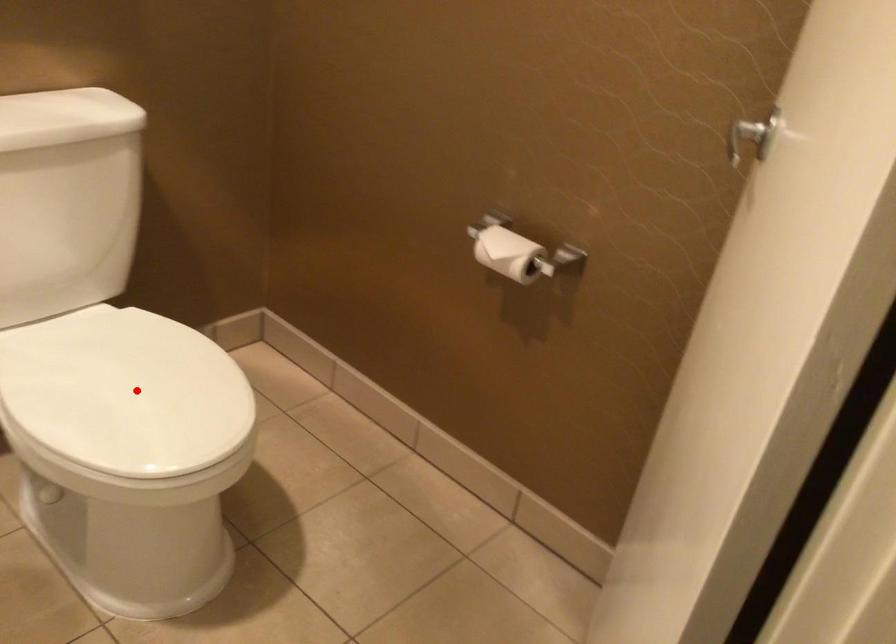
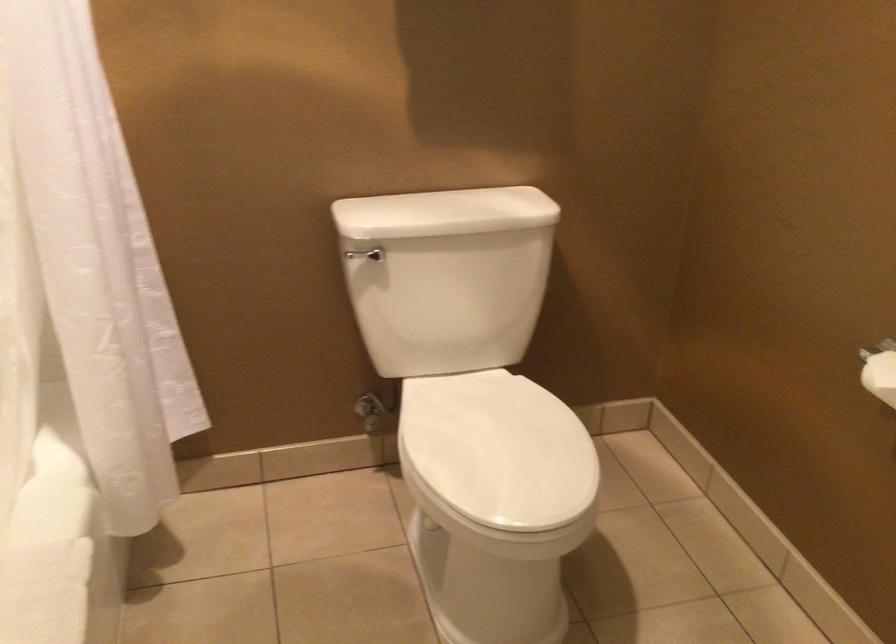
Question: I am providing you with two images of the same scene from different viewpoints. In image1, a red point is highlighted. Considering the same 3D point in image2, which of the following is correct?

Choices:
 (A) It is closer
 (B) It is farther

Answer: (B)